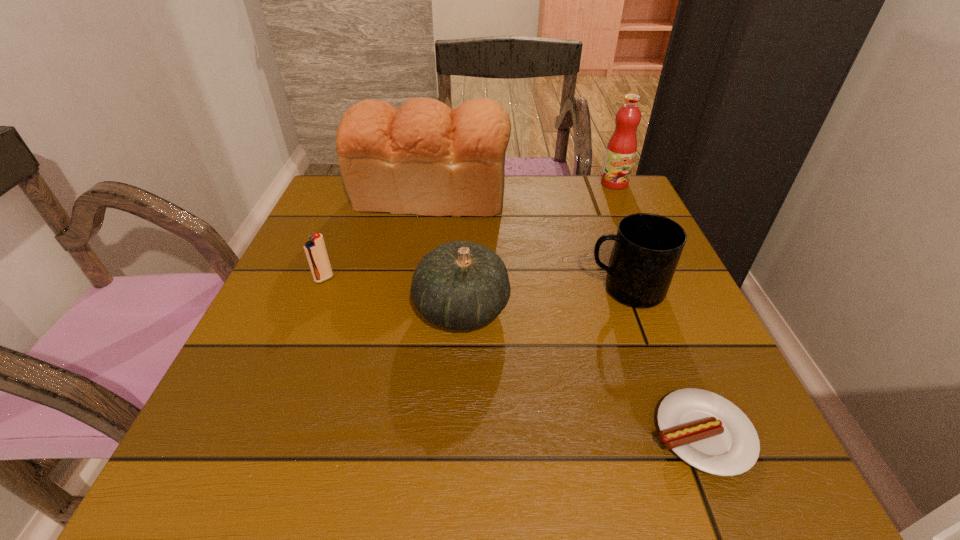
The width and height of the screenshot is (960, 540). What are the coordinates of `free space at the far left corner` in the screenshot? It's located at (376, 218).

Identify the location of blank area at the near left corner. (215, 454).

Locate an element on the screen. The width and height of the screenshot is (960, 540). blank space at the far right corner of the desktop is located at coordinates (630, 208).

Find the location of a particular element. This screenshot has width=960, height=540. free space that is in between the fruit juice and the gourd is located at coordinates (538, 246).

At what (x,y) coordinates should I click in order to perform the action: click on free spot between the mug and the nearest object. Please return your answer as a coordinate pair (x, y). Looking at the image, I should click on (663, 361).

Locate an element on the screen. unoccupied area between the bread and the fruit juice is located at coordinates (522, 190).

The height and width of the screenshot is (540, 960). What are the coordinates of `vacant area that lies between the gourd and the mug` in the screenshot? It's located at (543, 299).

Image resolution: width=960 pixels, height=540 pixels. I want to click on vacant area that lies between the mug and the bread, so click(528, 243).

The width and height of the screenshot is (960, 540). In order to click on free spot between the gourd and the igniter in this screenshot , I will do `click(393, 294)`.

Identify the location of free space between the gourd and the shortest object. This screenshot has height=540, width=960. (582, 371).